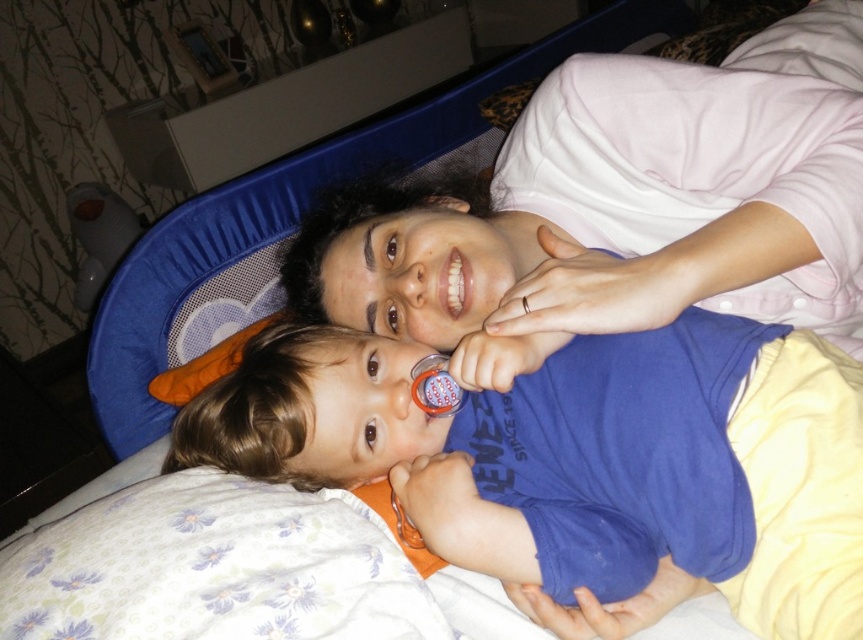
Based on the photo, is blue matte shirt at center taller than white glossy teeth at center?

Yes, blue matte shirt at center is taller than white glossy teeth at center.

Does point (436, 541) come farther from viewer compared to point (452, 259)?

No.

Does point (316, 484) come closer to viewer compared to point (449, 292)?

No, it is behind (449, 292).

Locate an element on the screen. This screenshot has width=863, height=640. blue matte shirt at center is located at coordinates (583, 460).

Which of these two, blue matte shirt at center or rubber teething ring at mouth, stands shorter?

rubber teething ring at mouth is shorter.

What do you see at coordinates (583, 460) in the screenshot? The width and height of the screenshot is (863, 640). I see `blue matte shirt at center` at bounding box center [583, 460].

Is point (821, 570) farther from camera compared to point (526, 298)?

That is False.

The width and height of the screenshot is (863, 640). Find the location of `blue matte shirt at center`. blue matte shirt at center is located at coordinates (583, 460).

Can you confirm if white glossy teeth at center is positioned to the left of rubber teething ring at mouth?

Indeed, white glossy teeth at center is positioned on the left side of rubber teething ring at mouth.

Between white glossy teeth at center and rubber teething ring at mouth, which one has more height?

With more height is white glossy teeth at center.

Is point (463, 273) positioned behind point (526, 301)?

Yes, point (463, 273) is farther from viewer.

Image resolution: width=863 pixels, height=640 pixels. I want to click on white glossy teeth at center, so click(x=455, y=284).